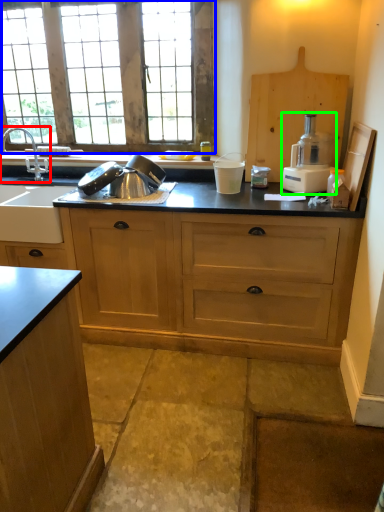
Question: Which object is the farthest from tap (highlighted by a red box)? Choose among these: window (highlighted by a blue box) or kitchen appliance (highlighted by a green box).

Choices:
 (A) window
 (B) kitchen appliance

Answer: (B)